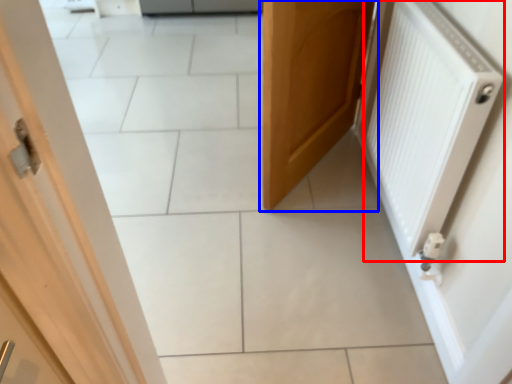
Question: Which object is closer to the camera taking this photo, radiator (highlighted by a red box) or door (highlighted by a blue box)?

Choices:
 (A) radiator
 (B) door

Answer: (A)